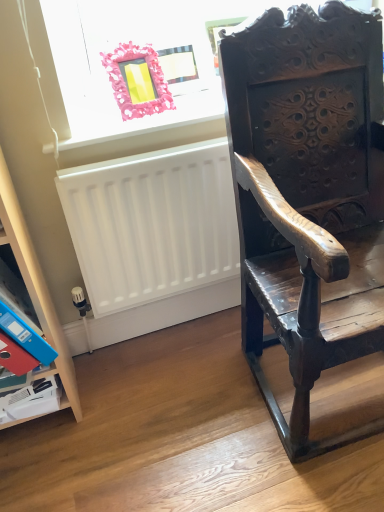
Find the location of a particular element. This screenshot has height=512, width=384. free space that is in between wooden shelf at lower left and dark wood carved chair at right is located at coordinates pyautogui.click(x=171, y=410).